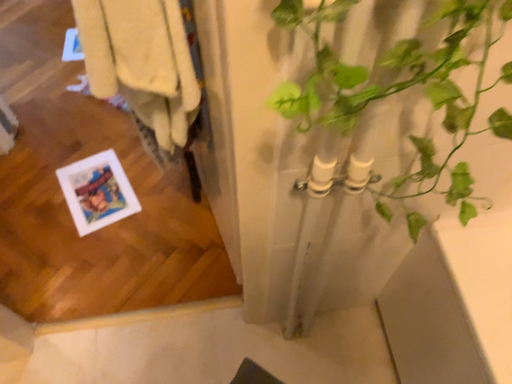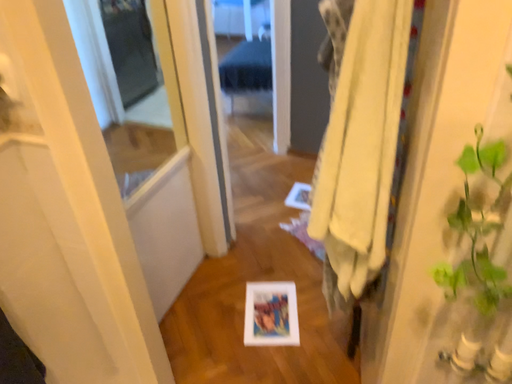
Question: How did the camera likely rotate when shooting the video?

Choices:
 (A) rotated upward
 (B) rotated downward

Answer: (A)